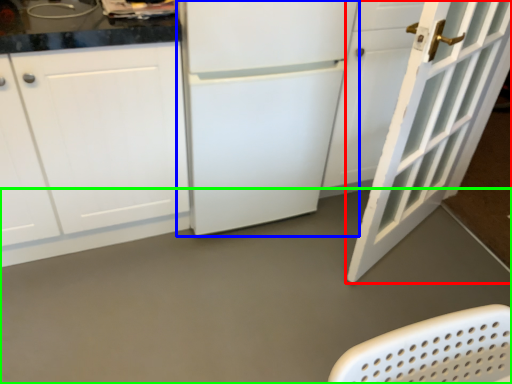
Question: Based on their relative distances, which object is nearer to door (highlighted by a red box)? Choose from refrigerator (highlighted by a blue box) and concrete (highlighted by a green box).

Choices:
 (A) refrigerator
 (B) concrete

Answer: (A)